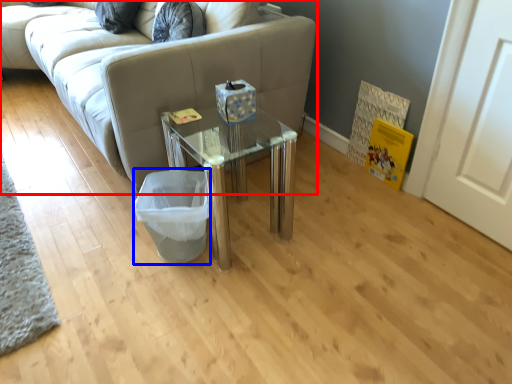
Question: Which point is closer to the camera, studio couch (highlighted by a red box) or laundry basket (highlighted by a blue box)?

Choices:
 (A) studio couch
 (B) laundry basket

Answer: (A)